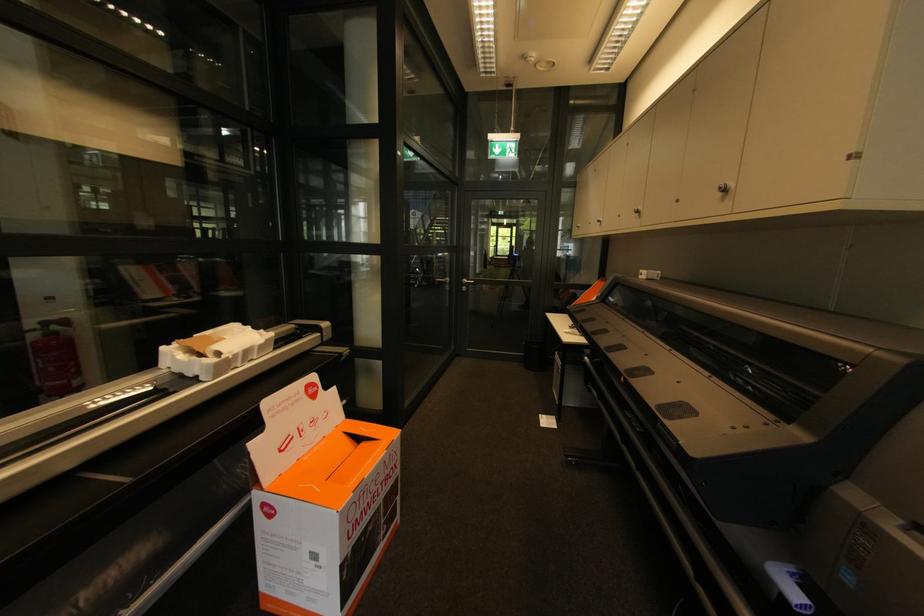
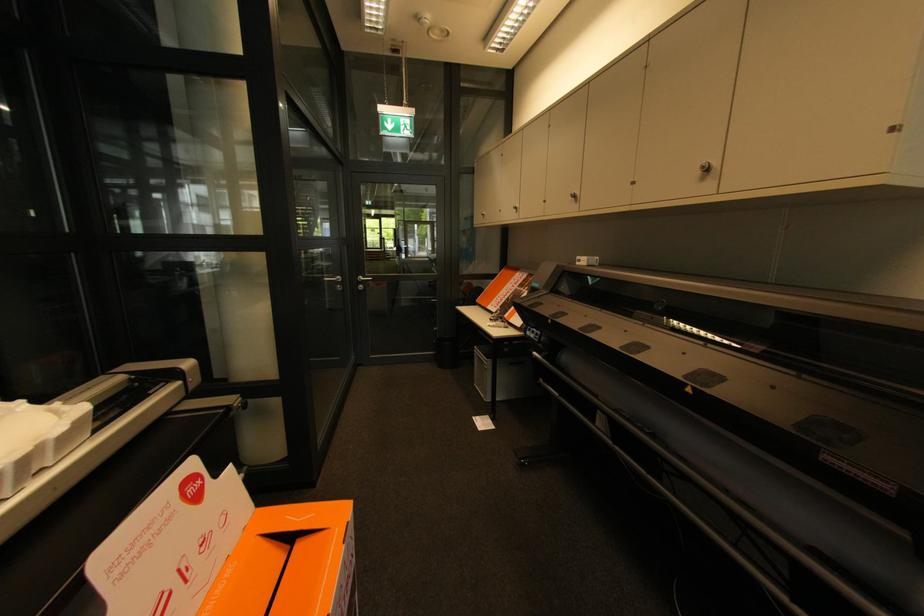
Where in the second image is the point corresponding to [468,289] from the first image?

(365, 286)